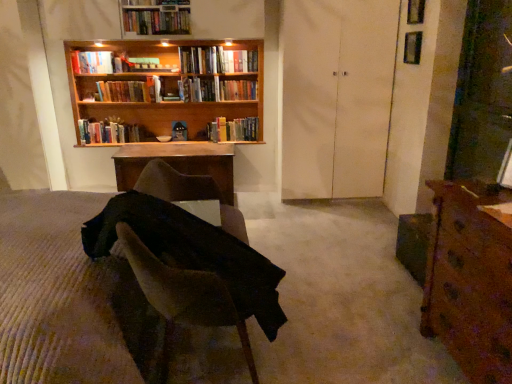
Locate an element on the screen. empty space that is ontop of hardcover book at upper center, placed as the second book when sorted from top to bottom (from a real-world perspective) is located at coordinates (241, 50).